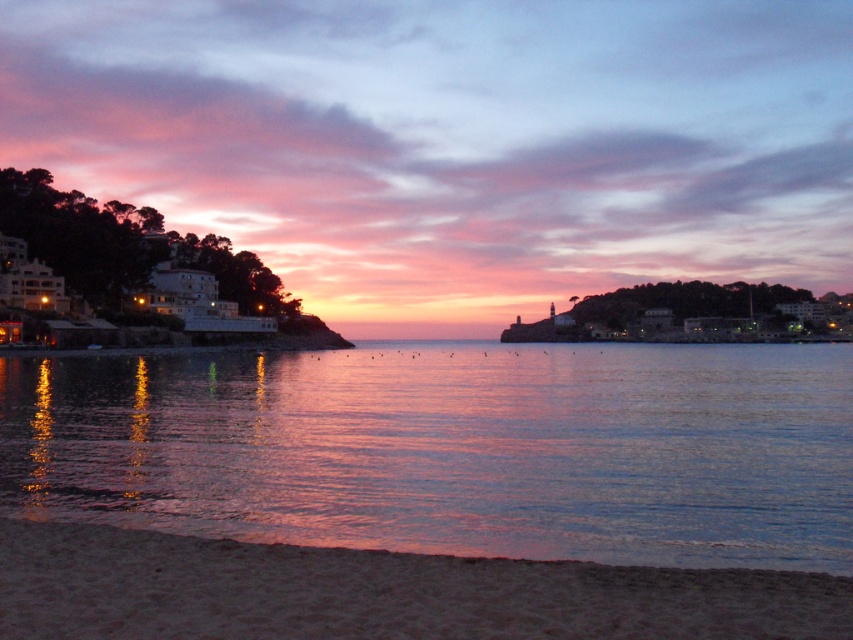
Question: Does shiny reflective water at lower center appear on the left side of sandy beach at lower left?

Choices:
 (A) yes
 (B) no

Answer: (B)

Question: Can you confirm if shiny reflective water at lower center is positioned below sandy beach at lower left?

Choices:
 (A) no
 (B) yes

Answer: (B)

Question: Is shiny reflective water at lower center thinner than sandy beach at lower left?

Choices:
 (A) yes
 (B) no

Answer: (B)

Question: Which of the following is the closest to the observer?

Choices:
 (A) sandy beach at lower left
 (B) shiny reflective water at lower center

Answer: (A)

Question: Which of the following is the closest to the observer?

Choices:
 (A) shiny reflective water at lower center
 (B) sandy beach at lower left

Answer: (B)

Question: Which of the following is the closest to the observer?

Choices:
 (A) shiny reflective water at lower center
 (B) sandy beach at lower left

Answer: (B)